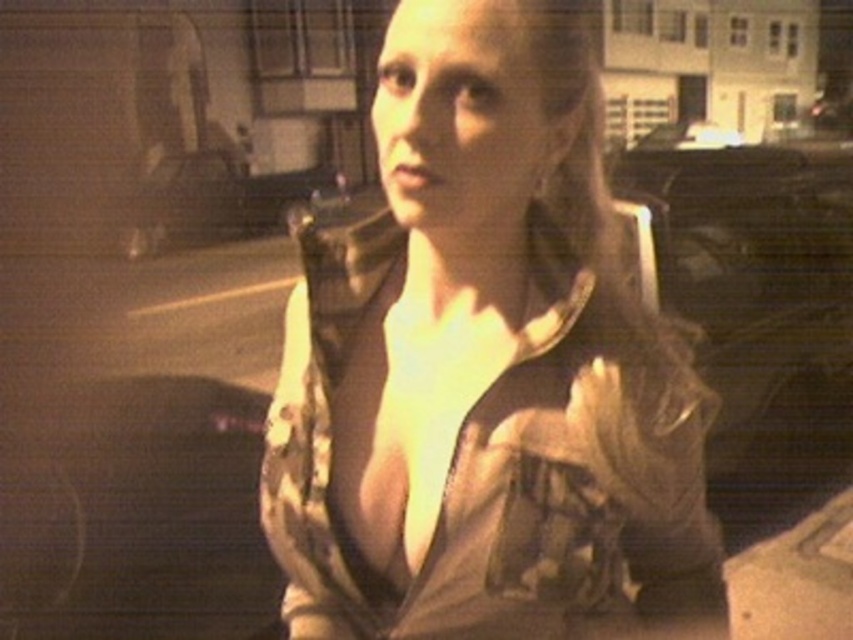
Is camo fabric jacket at center thinner than metallic silver car at center?

Correct, camo fabric jacket at center's width is less than metallic silver car at center's.

Which is below, camo fabric jacket at center or metallic silver car at center?

Positioned lower is camo fabric jacket at center.

Does point (508, 371) come behind point (141, 189)?

No, (508, 371) is in front of (141, 189).

In order to click on camo fabric jacket at center in this screenshot , I will do click(x=486, y=369).